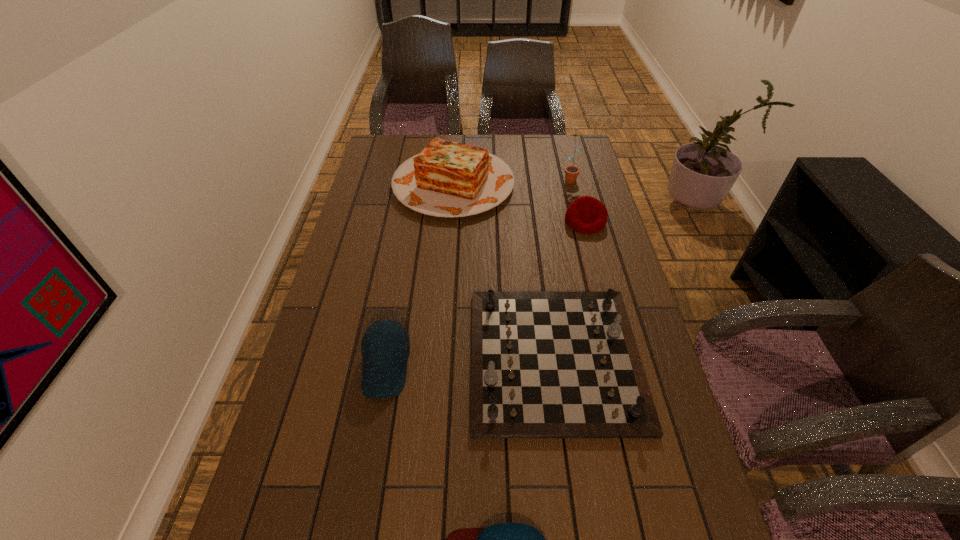
Where is `vacant space positioned 0.260m on the board of the chessboard`? vacant space positioned 0.260m on the board of the chessboard is located at coordinates (372, 358).

The width and height of the screenshot is (960, 540). What are the coordinates of `free location located on the board of the chessboard` in the screenshot? It's located at (437, 358).

Where is `vacant point located on the seat area of the beanbag`? vacant point located on the seat area of the beanbag is located at coordinates (613, 330).

Image resolution: width=960 pixels, height=540 pixels. What are the coordinates of `object that is at the far edge` in the screenshot? It's located at (449, 179).

What are the coordinates of `lasagna located in the left edge section of the desktop` in the screenshot? It's located at click(x=449, y=179).

You are a GUI agent. You are given a task and a screenshot of the screen. Output one action in this format:
    pyautogui.click(x=<x>, y=<y>)
    Task: Click on the baseball cap situated at the left edge
    This screenshot has width=960, height=540.
    Given the screenshot: What is the action you would take?
    pyautogui.click(x=385, y=346)

Where is `sunflower located at the right edge`? This screenshot has height=540, width=960. sunflower located at the right edge is located at coordinates (571, 172).

What are the coordinates of `chessboard located at the right edge` in the screenshot? It's located at (544, 364).

Find the location of a particular element. beanbag located in the right edge section of the desktop is located at coordinates (587, 215).

This screenshot has height=540, width=960. What are the coordinates of `object at the far left corner` in the screenshot? It's located at point(449,179).